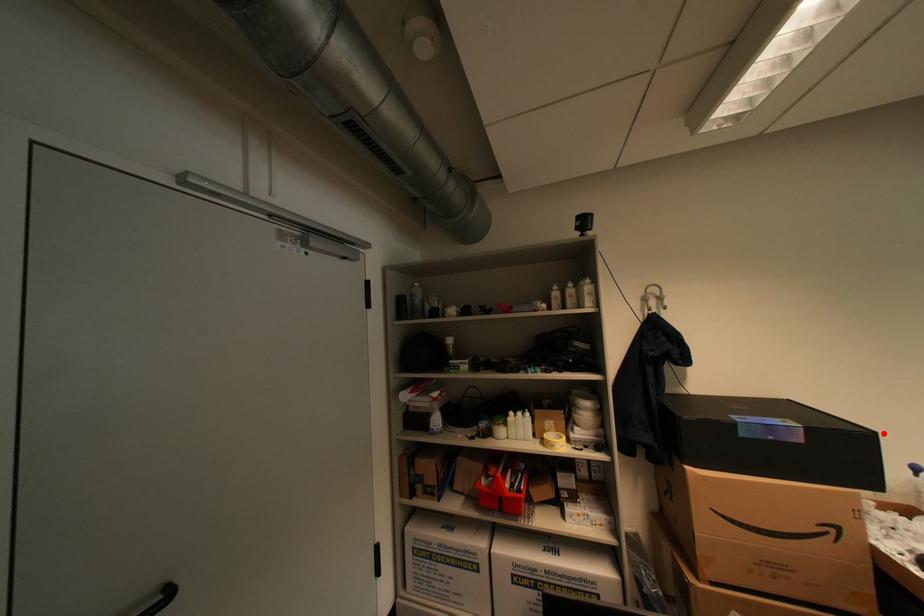
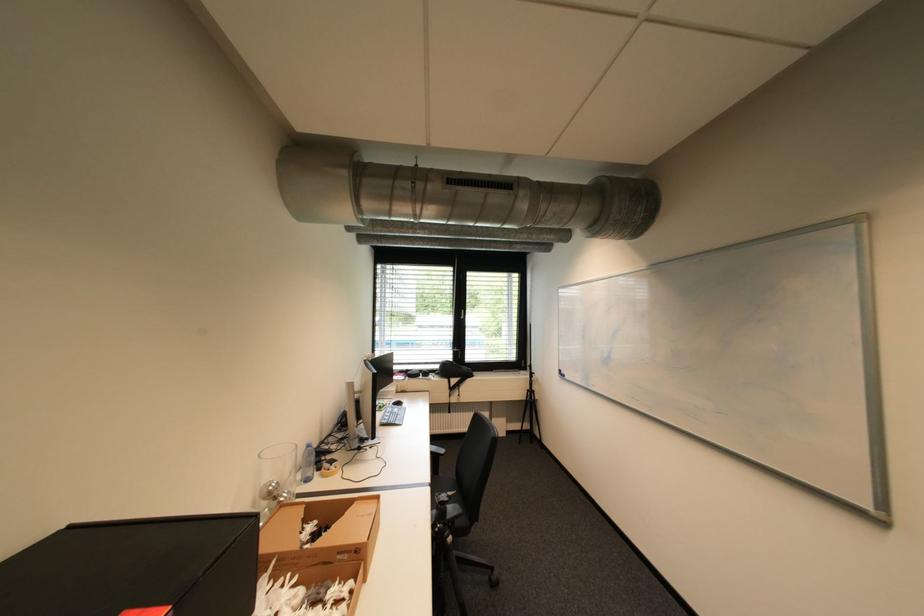
Locate, in the second image, the point that corresponds to the highlighted location in the first image.

(265, 516)